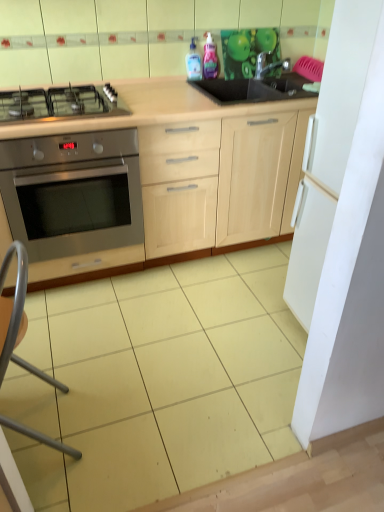
Question: Does light wood cabinet at center have a lesser width compared to stainless steel oven at left?

Choices:
 (A) no
 (B) yes

Answer: (B)

Question: Can you confirm if light wood cabinet at center is taller than stainless steel oven at left?

Choices:
 (A) no
 (B) yes

Answer: (B)

Question: From the image's perspective, does light wood cabinet at center appear lower than stainless steel oven at left?

Choices:
 (A) no
 (B) yes

Answer: (A)

Question: Can you confirm if light wood cabinet at center is bigger than stainless steel oven at left?

Choices:
 (A) no
 (B) yes

Answer: (B)

Question: Is light wood cabinet at center completely or partially outside of stainless steel oven at left?

Choices:
 (A) no
 (B) yes

Answer: (B)

Question: From the image's perspective, relative to pink glossy bottle at upper center, the 2th bottle positioned from the left, is metallic silver folding chair at lower left above or below?

Choices:
 (A) above
 (B) below

Answer: (B)

Question: Is metallic silver folding chair at lower left wider or thinner than pink glossy bottle at upper center, the 2th bottle positioned from the left?

Choices:
 (A) thin
 (B) wide

Answer: (B)

Question: Considering the positions of point (21, 432) and point (203, 74), is point (21, 432) closer or farther from the camera than point (203, 74)?

Choices:
 (A) farther
 (B) closer

Answer: (B)

Question: From a real-world perspective, relative to pink glossy bottle at upper center, the 2th bottle positioned from the left, is metallic silver folding chair at lower left vertically above or below?

Choices:
 (A) above
 (B) below

Answer: (B)

Question: Considering the relative positions of metallic silver folding chair at lower left and transparent plastic bottle at upper center, which ranks as the second bottle in right-to-left order, in the image provided, is metallic silver folding chair at lower left to the left or to the right of transparent plastic bottle at upper center, which ranks as the second bottle in right-to-left order,?

Choices:
 (A) right
 (B) left

Answer: (B)

Question: Is metallic silver folding chair at lower left wider or thinner than transparent plastic bottle at upper center, which ranks as the second bottle in right-to-left order?

Choices:
 (A) wide
 (B) thin

Answer: (A)

Question: From the image's perspective, relative to transparent plastic bottle at upper center, which ranks as the second bottle in right-to-left order, is metallic silver folding chair at lower left above or below?

Choices:
 (A) above
 (B) below

Answer: (B)

Question: Is metallic silver folding chair at lower left in front of or behind transparent plastic bottle at upper center, which ranks as the second bottle in right-to-left order, in the image?

Choices:
 (A) front
 (B) behind

Answer: (A)

Question: From the image's perspective, is satin silver gas stove at left located above or below pink glossy bottle at upper center, the 2th bottle positioned from the left?

Choices:
 (A) below
 (B) above

Answer: (A)

Question: From a real-world perspective, relative to pink glossy bottle at upper center, the first bottle when ordered from right to left, is satin silver gas stove at left vertically above or below?

Choices:
 (A) below
 (B) above

Answer: (A)